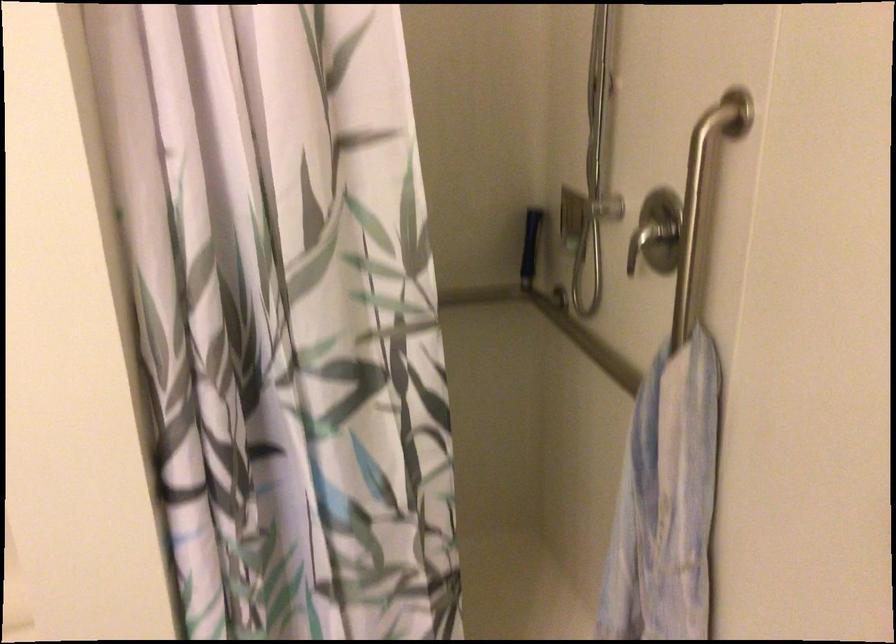
The height and width of the screenshot is (644, 896). What do you see at coordinates (702, 194) in the screenshot? I see `the metal grab bar` at bounding box center [702, 194].